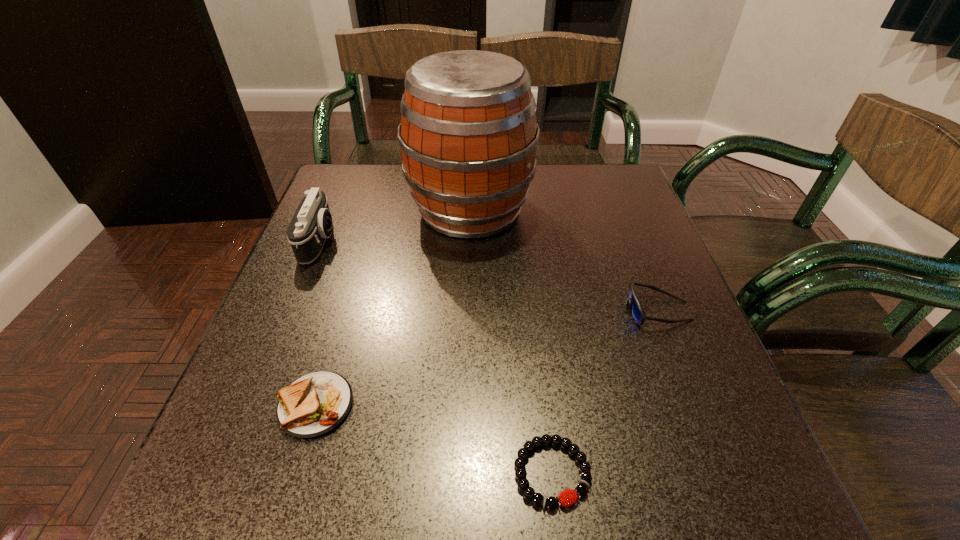
Find the location of a particular element. free point between the camera and the rightmost object is located at coordinates point(489,276).

Locate an element on the screen. empty space that is in between the rightmost object and the second tallest object is located at coordinates (489, 276).

This screenshot has height=540, width=960. What are the coordinates of `vacant region between the bracelet and the third farthest object` in the screenshot? It's located at (605, 392).

Where is `vacant space in between the cider and the bracelet`? vacant space in between the cider and the bracelet is located at coordinates (511, 341).

What are the coordinates of `free space between the second tallest object and the shortest object` in the screenshot? It's located at (436, 357).

Locate an element on the screen. vacant area that lies between the camera and the second object from left to right is located at coordinates (318, 323).

Where is `object that is the fourth closest one to the sunglasses`? The width and height of the screenshot is (960, 540). object that is the fourth closest one to the sunglasses is located at coordinates (x=311, y=224).

Identify which object is located as the second nearest to the fourth shortest object. Please provide its 2D coordinates. Your answer should be formatted as a tuple, i.e. [(x, y)], where the tuple contains the x and y coordinates of a point satisfying the conditions above.

[(313, 405)]

At what (x,y) coordinates should I click in order to perform the action: click on blank space that satisfies the following two spatial constraints: 1. on the front lens of the leftmost object; 2. on the left side of the second shortest object. Please return your answer as a coordinate pair (x, y). This screenshot has height=540, width=960. Looking at the image, I should click on pyautogui.click(x=253, y=405).

Where is `vacant point that satisfies the following two spatial constraints: 1. on the front-facing side of the sunglasses; 2. on the front side of the shortest object`? vacant point that satisfies the following two spatial constraints: 1. on the front-facing side of the sunglasses; 2. on the front side of the shortest object is located at coordinates (720, 472).